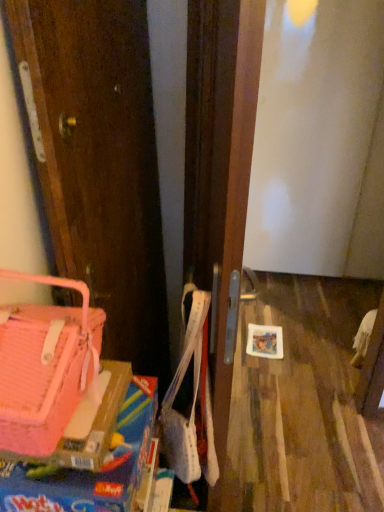
Question: From a real-world perspective, is pink fabric handbag at left above or below pink plastic box at lower left?

Choices:
 (A) above
 (B) below

Answer: (A)

Question: Which is correct: pink fabric handbag at left is inside pink plastic box at lower left, or outside of it?

Choices:
 (A) outside
 (B) inside

Answer: (A)

Question: Is point (29, 314) closer or farther from the camera than point (132, 422)?

Choices:
 (A) farther
 (B) closer

Answer: (B)

Question: In terms of width, does pink plastic box at lower left look wider or thinner when compared to pink fabric handbag at left?

Choices:
 (A) thin
 (B) wide

Answer: (B)

Question: From a real-world perspective, is pink plastic box at lower left above or below pink fabric handbag at left?

Choices:
 (A) above
 (B) below

Answer: (B)

Question: Considering the positions of point (19, 509) and point (59, 417), is point (19, 509) closer or farther from the camera than point (59, 417)?

Choices:
 (A) closer
 (B) farther

Answer: (A)

Question: Based on their positions, is pink plastic box at lower left located to the left or right of pink fabric handbag at left?

Choices:
 (A) left
 (B) right

Answer: (B)